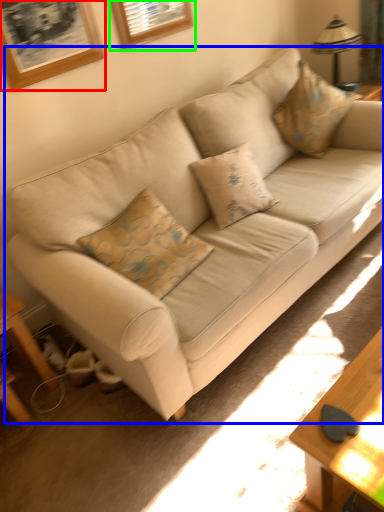
Question: Considering the real-world distances, which object is farthest from picture frame (highlighted by a red box)? studio couch (highlighted by a blue box) or picture frame (highlighted by a green box)?

Choices:
 (A) studio couch
 (B) picture frame

Answer: (A)